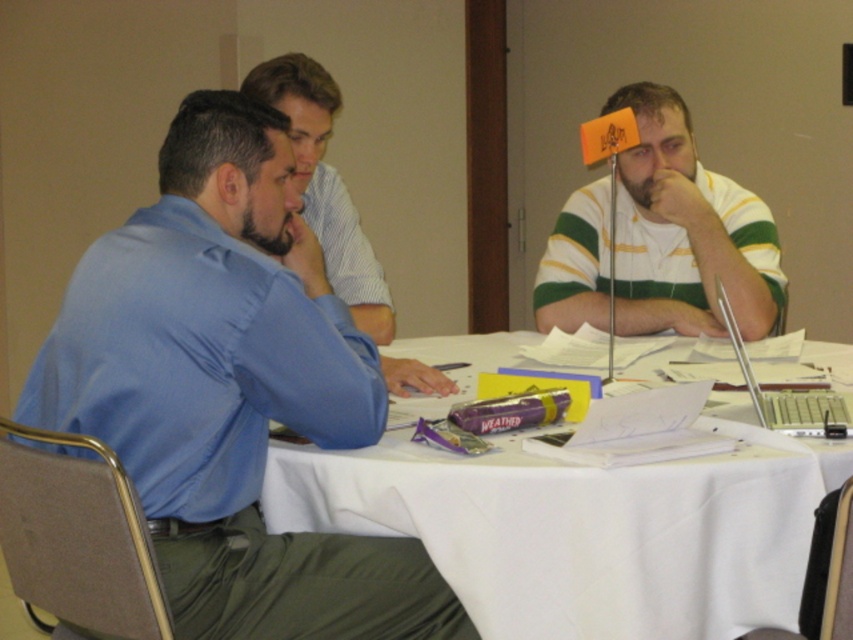
Question: Can you confirm if striped jersey at center is smaller than silver metallic laptop at right?

Choices:
 (A) yes
 (B) no

Answer: (B)

Question: Which of the following is the farthest from the observer?

Choices:
 (A) (772, 426)
 (B) (427, 352)
 (C) (751, 314)

Answer: (B)

Question: Does white cloth table at center have a greater width compared to silver metallic laptop at right?

Choices:
 (A) yes
 (B) no

Answer: (A)

Question: Does blue cotton shirt at left appear over white cloth table at center?

Choices:
 (A) yes
 (B) no

Answer: (A)

Question: Which object is positioned farthest from the white cloth table at center?

Choices:
 (A) blue cotton shirt at left
 (B) striped jersey at center
 (C) silver metallic laptop at right

Answer: (B)

Question: Which object is the farthest from the silver metallic laptop at right?

Choices:
 (A) blue cotton shirt at left
 (B) blue shirt at left

Answer: (B)